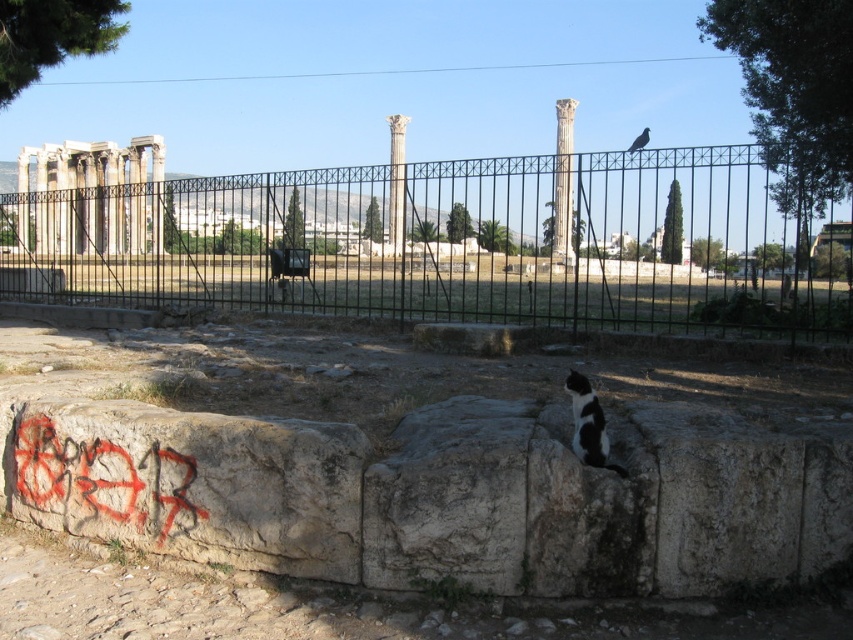
Question: Which object is farther from the camera taking this photo?

Choices:
 (A) smooth stone column at center
 (B) black and white fur cat at center

Answer: (A)

Question: Does black metal fence at center appear on the right side of white marble columns at left?

Choices:
 (A) yes
 (B) no

Answer: (A)

Question: Can you confirm if smooth white column at center is wider than smooth stone column at center?

Choices:
 (A) no
 (B) yes

Answer: (B)

Question: Which point is farther to the camera?

Choices:
 (A) (556, 232)
 (B) (585, 451)

Answer: (A)

Question: Which of the following is the farthest from the observer?

Choices:
 (A) (556, 252)
 (B) (397, 124)
 (C) (625, 476)

Answer: (B)

Question: Does smooth white column at center appear over smooth stone column at center?

Choices:
 (A) no
 (B) yes

Answer: (A)